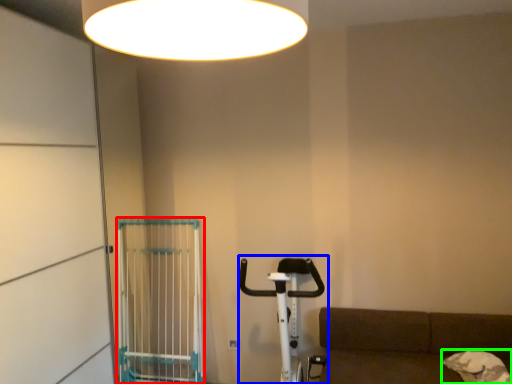
Question: Considering the real-world distances, which object is farthest from cage (highlighted by a red box)? baby carriage (highlighted by a blue box) or dog (highlighted by a green box)?

Choices:
 (A) baby carriage
 (B) dog

Answer: (B)